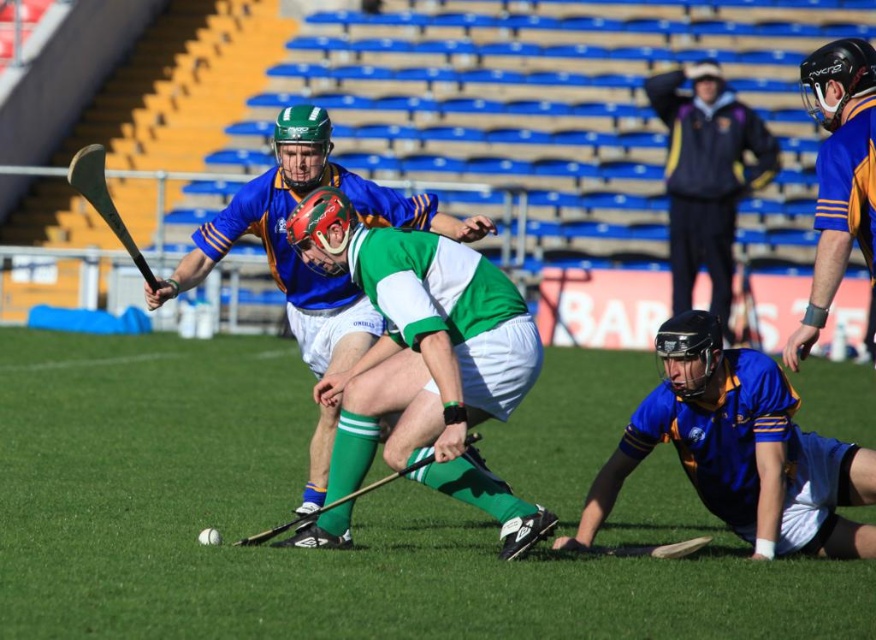
You are a sports analyst watching the hurling match. You notice the green matte jersey at center and the blue jersey at lower right. Which player is blocking the view of the other?

The green matte jersey at center is positioned over blue jersey at lower right, so the green matte jersey at center is blocking the view of the blue jersey at lower right.

You are a sports analyst watching the hurling match. You notice two players wearing blue. The first is the blue jersey at lower right, and the second is the dark blue jacket at upper center. Which player is closer to the ground?

The blue jersey at lower right is shorter than the dark blue jacket at upper center, so the blue jersey at lower right is closer to the ground.

You are a sports analyst watching a hurling match. You notice two players, the green matte jersey at center and the blue jersey at lower right. Based on their positions, which player is closer to the ball located at the bottom left of the frame?

The green matte jersey at center is positioned on the left side of blue jersey at lower right, so the green matte jersey at center is closer to the ball located at the bottom left of the frame.